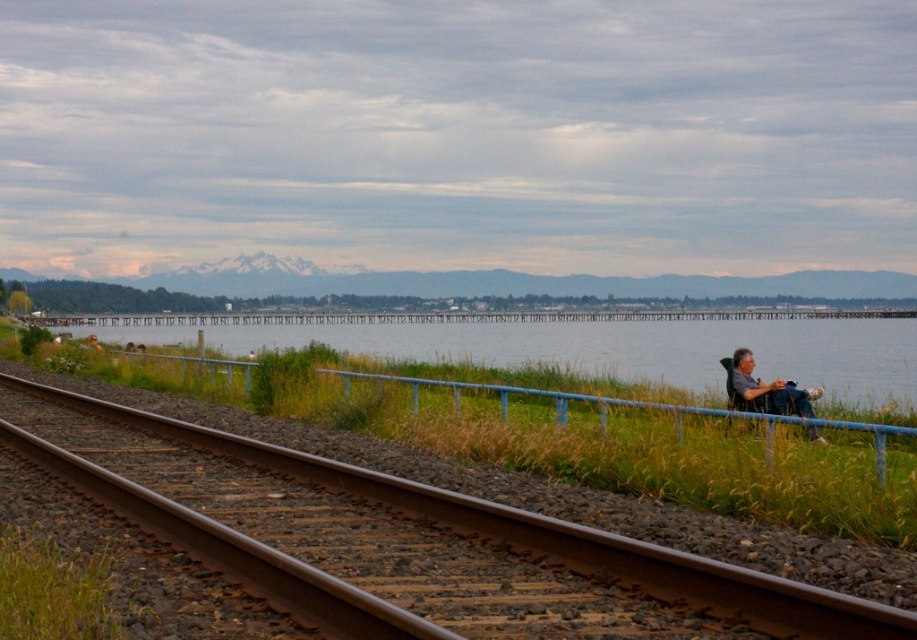
You are a maintenance worker who needs to transport a 100 feet long equipment from the clear blue water at center to the gray fabric chair at right. Can you move the equipment directly between them without bending or cutting it?

The clear blue water at center and gray fabric chair at right are 159.38 feet apart from each other, so the 100 feet long equipment can be moved directly between them without bending or cutting since it is shorter than the distance between them.

You are standing on the railway track and see the green grass at lower left and the gray fabric chair at right. Which object is closer to your current position?

The green grass at lower left is closer to your current position because it is positioned under the gray fabric chair at right, indicating it is lower and nearer to the railway track where you are standing.